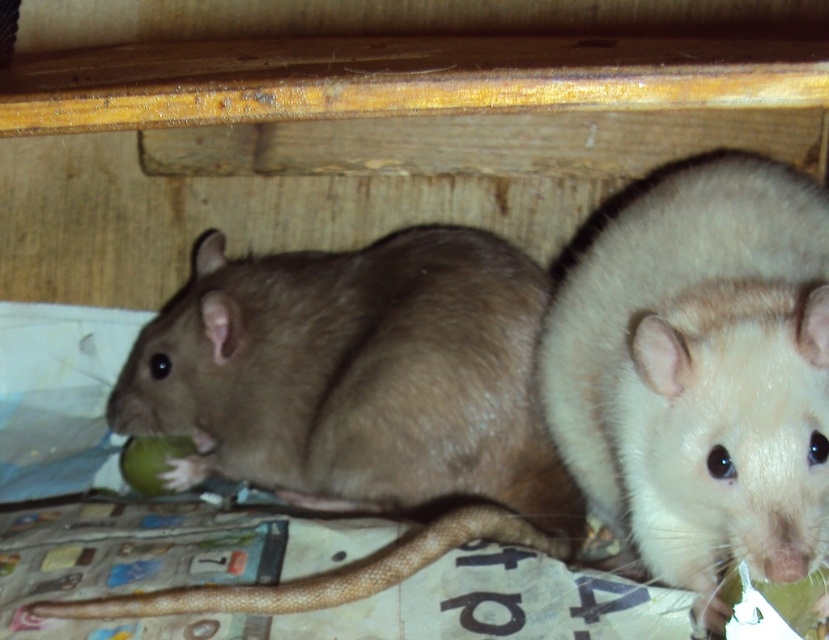
Can you confirm if brown furry mouse at center is taller than light beige fur hamster at right?

Incorrect, brown furry mouse at center's height is not larger of light beige fur hamster at right's.

Is point (515, 486) closer to viewer compared to point (580, 419)?

No, (515, 486) is behind (580, 419).

Which is in front, point (556, 554) or point (774, 561)?

Point (774, 561) is in front.

This screenshot has width=829, height=640. What are the coordinates of `brown furry mouse at center` in the screenshot? It's located at (352, 401).